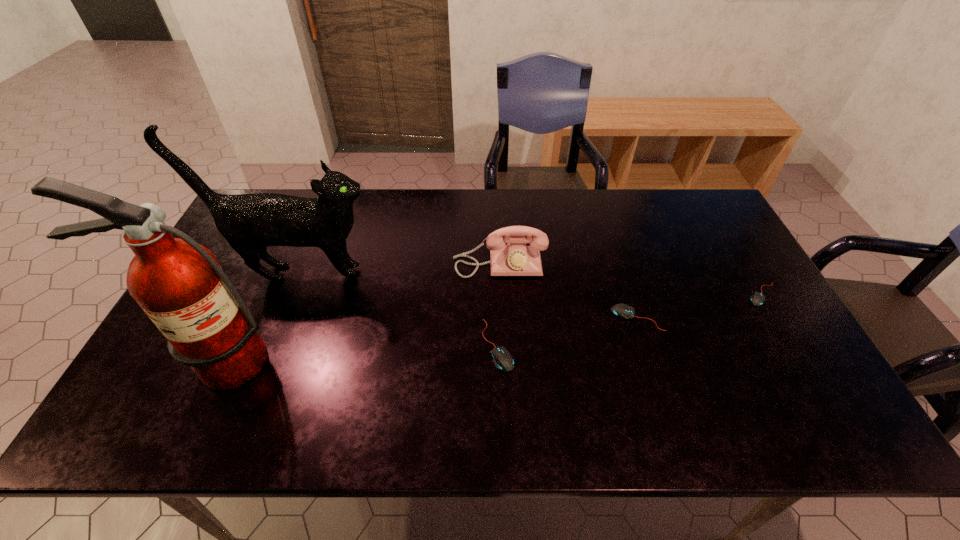
The mouses are evenly distributed in the image. To maintain this, where would you place another mouse on the left? Please point to a free space. Please provide its 2D coordinates. Your answer should be formatted as a tuple, i.e. [(x, y)], where the tuple contains the x and y coordinates of a point satisfying the conditions above.

[(343, 374)]